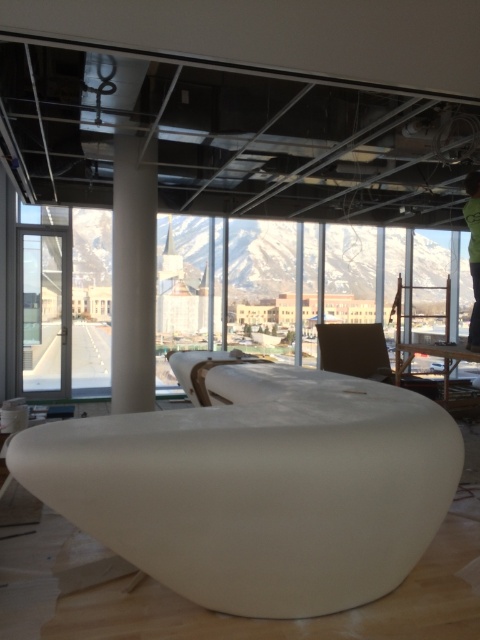
Question: Which point appears farthest from the camera in this image?

Choices:
 (A) (129, 234)
 (B) (143, 520)
 (C) (420, 348)

Answer: (C)

Question: Among these objects, which one is farthest from the camera?

Choices:
 (A) white smooth column at center
 (B) white matte/soft furniture at center
 (C) white glossy table at center
 (D) green fabric person at center

Answer: (A)

Question: Is white matte/soft furniture at center above white glossy table at center?

Choices:
 (A) no
 (B) yes

Answer: (A)

Question: Where is white smooth column at center located in relation to green fabric person at center in the image?

Choices:
 (A) left
 (B) right

Answer: (A)

Question: Which point is closer to the camera taking this photo?

Choices:
 (A) (180, 369)
 (B) (120, 221)

Answer: (A)

Question: Is white glossy table at center to the left of green fabric person at center from the viewer's perspective?

Choices:
 (A) yes
 (B) no

Answer: (B)